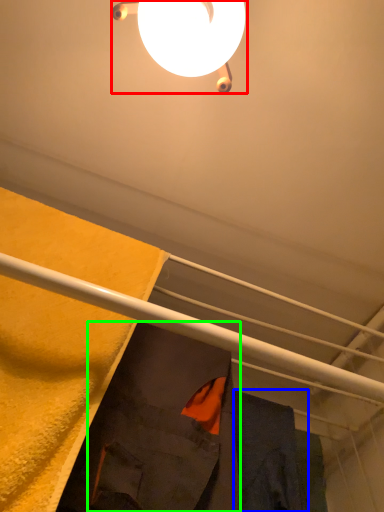
Question: Which object is the closest to the lamp (highlighted by a red box)? Choose among these: robe (highlighted by a blue box) or robe (highlighted by a green box).

Choices:
 (A) robe
 (B) robe

Answer: (B)